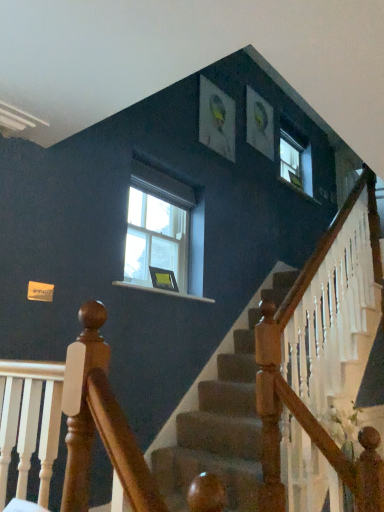
Question: Relative to clear glass window at center, is matte black picture frame at center in front or behind?

Choices:
 (A) front
 (B) behind

Answer: (B)

Question: In terms of size, does matte black picture frame at center appear bigger or smaller than clear glass window at center?

Choices:
 (A) small
 (B) big

Answer: (A)

Question: Considering the positions of point (152, 270) and point (187, 188), is point (152, 270) closer or farther from the camera than point (187, 188)?

Choices:
 (A) farther
 (B) closer

Answer: (B)

Question: In terms of size, does clear glass window at center appear bigger or smaller than matte black picture frame at center?

Choices:
 (A) small
 (B) big

Answer: (B)

Question: Does point [135, 200] appear closer or farther from the camera than point [152, 273]?

Choices:
 (A) closer
 (B) farther

Answer: (B)

Question: Is clear glass window at center taller or shorter than matte black picture frame at center?

Choices:
 (A) short
 (B) tall

Answer: (B)

Question: Is clear glass window at center in front of or behind matte black picture frame at center in the image?

Choices:
 (A) front
 (B) behind

Answer: (A)